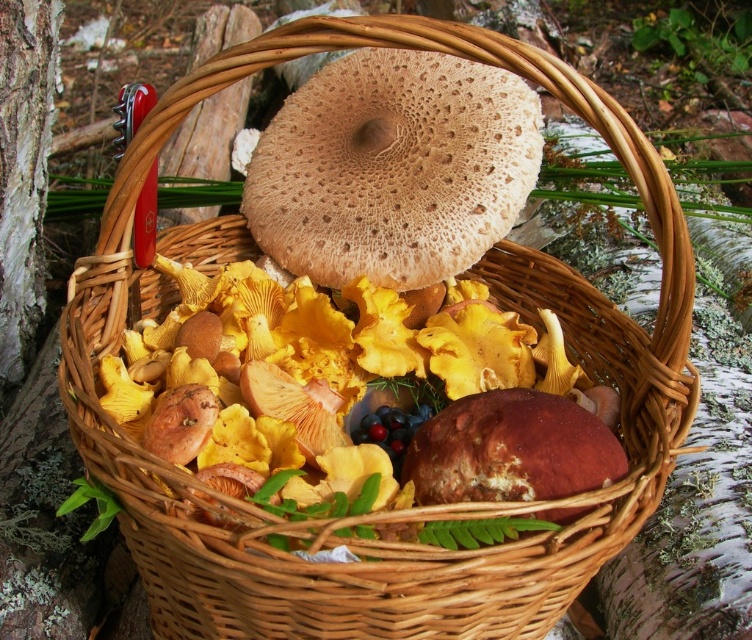
Question: Among these objects, which one is farthest from the camera?

Choices:
 (A) white bark at left
 (B) yellow/golden flesh at center

Answer: (A)

Question: Can you confirm if white bark at left is smaller than shiny purple grapes at center?

Choices:
 (A) no
 (B) yes

Answer: (A)

Question: Does yellow/golden flesh at center lie behind white bark at left?

Choices:
 (A) no
 (B) yes

Answer: (A)

Question: Is yellow/golden flesh at center to the left of white bark at left from the viewer's perspective?

Choices:
 (A) yes
 (B) no

Answer: (B)

Question: Which object is closer to the camera taking this photo?

Choices:
 (A) shiny purple grapes at center
 (B) white bark at left
 (C) yellow/golden flesh at center

Answer: (C)

Question: Which object is the closest to the yellow/golden flesh at center?

Choices:
 (A) shiny purple grapes at center
 (B) white bark at left

Answer: (A)